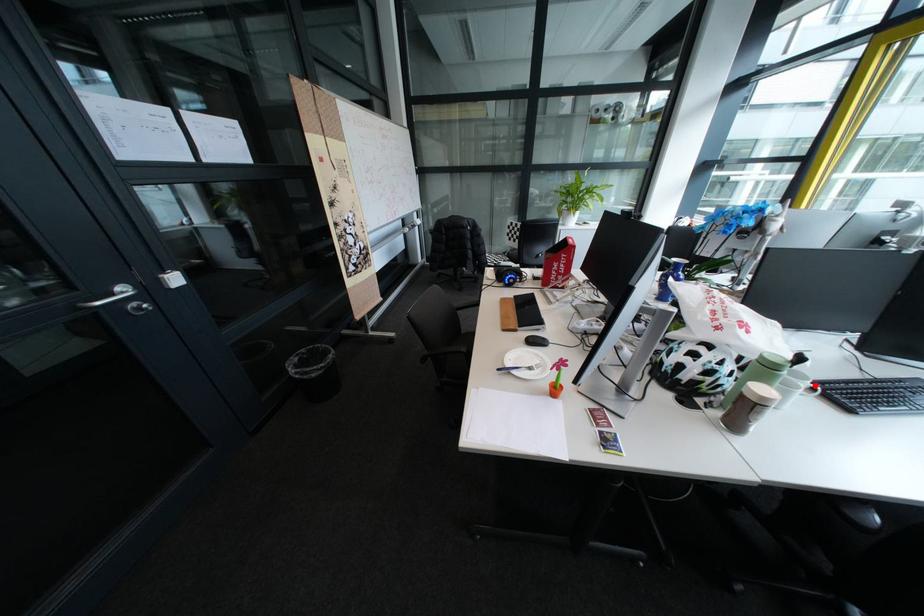
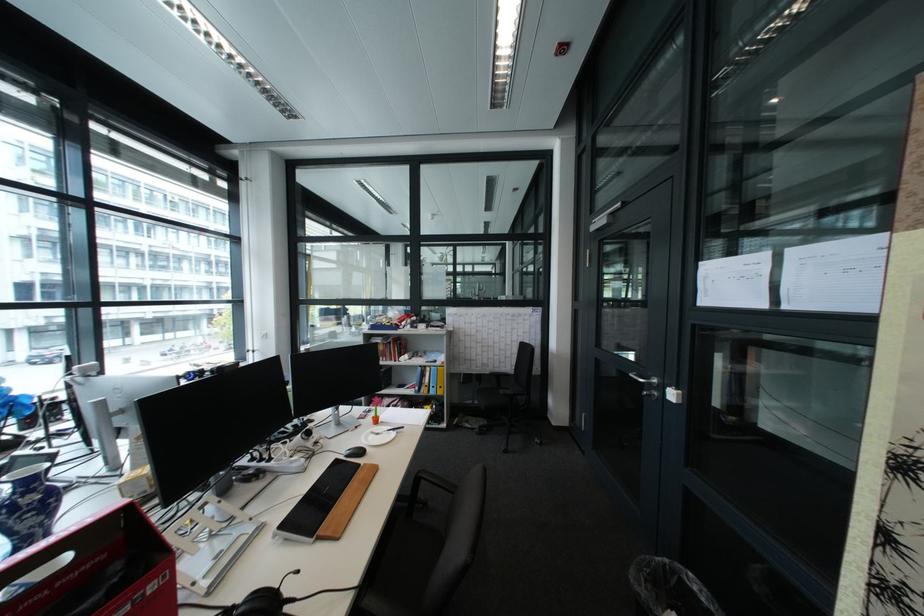
Question: I am providing you with two images of the same scene from different viewpoints. A red point is marked on the first image. Can you still see the location of the red point in image 2?

Choices:
 (A) Yes
 (B) No

Answer: (B)